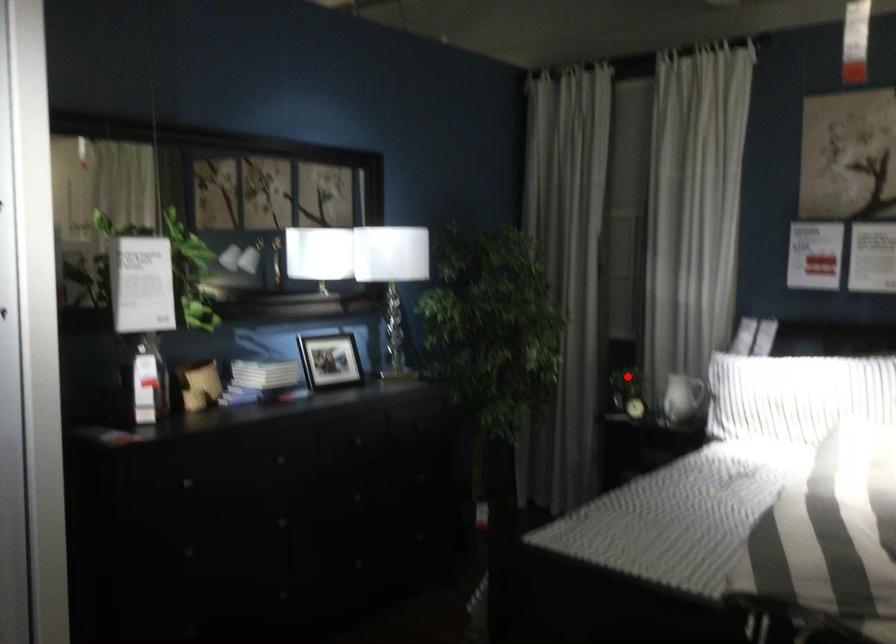
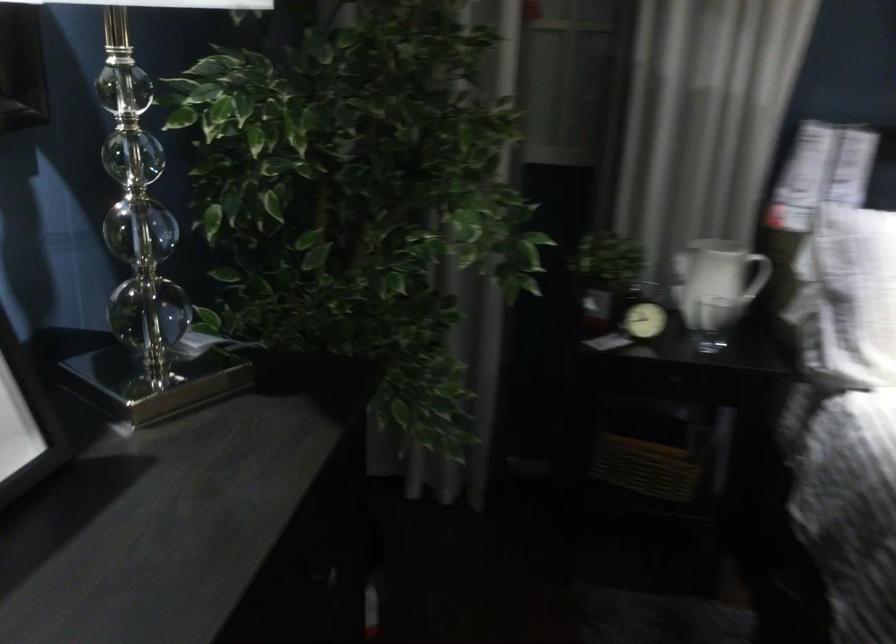
Locate, in the second image, the point that corresponds to the highlighted location in the first image.

(605, 275)